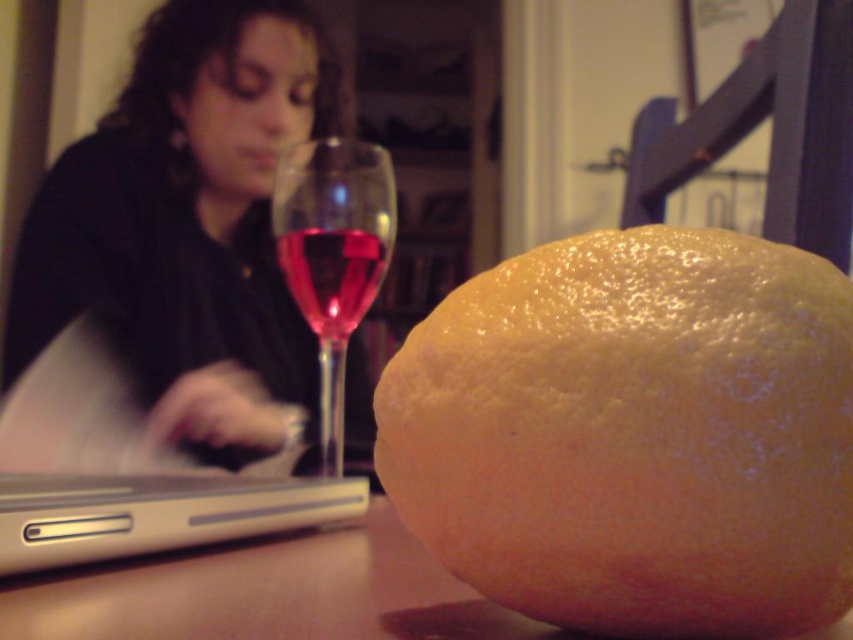
You are trying to place a 10 cm wide book on the smooth wooden table at lower center. If the table is 1.2 meters wide, will the book fit on it?

The smooth wooden table at lower center is 1.2 meters wide, so a 10 cm wide book will easily fit on it since 10 cm is much smaller than 120 cm.

You are organizing a still life setup for a photography session. You have a yellow matte grapefruit at center placed at coordinates 0.680, 0.744. If you need to position a new object at coordinates 0.7, 0.7 to balance the composition, will the new object overlap with the grapefruit?

The yellow matte grapefruit at center is located at point (634, 435). The new object at (596, 448) is very close but not exactly overlapping. However, depending on the size of the grapefruit and the new object, there might be slight overlap. To ensure no overlap, adjust the new object slightly further away from the grapefruit.

You are organizing a dinner party and need to place a decorative centerpiece on the smooth wooden table at lower center. However, there is already a translucent glass wine at center. Can the centerpiece fit on the table without overlapping the wine glass?

The smooth wooden table at lower center is bigger than the translucent glass wine at center, so yes, there should be enough space to place the centerpiece on the table without overlapping the wine glass.